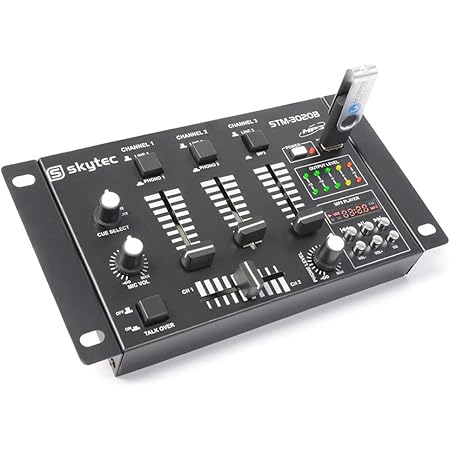
What are the coordinates of `white and black knob` in the screenshot? It's located at point(135,249).